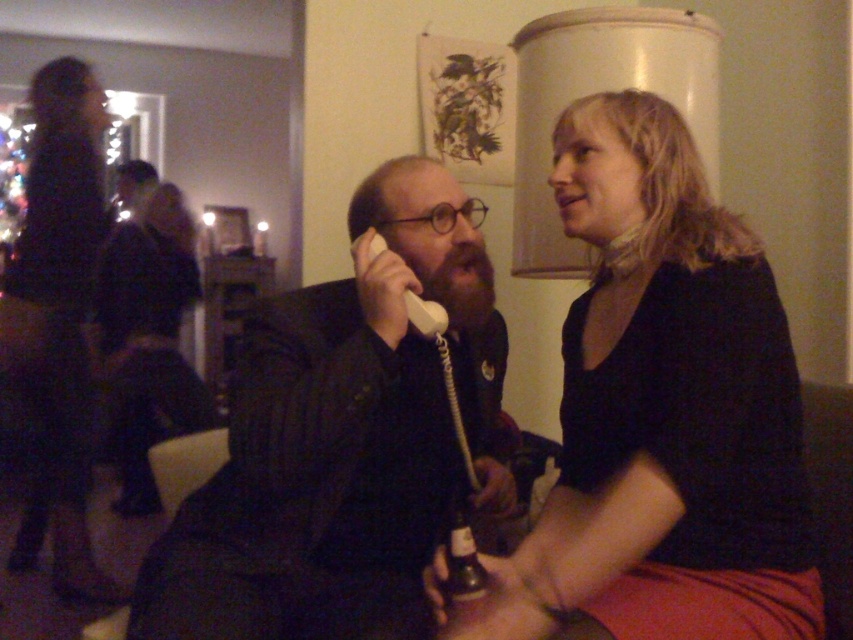
You are at a party and want to use the matte black phone at center to call someone. However, you need to reach it first. Since the dark fabric dress at left is in the way, can you still access the phone without moving the dress?

The matte black phone at center is located below dark fabric dress at left, so you can access the phone by reaching under the dark fabric dress at left without needing to move it.

You are a photographer trying to capture a clear photo of the matte black shirt at center and the matte black phone at center. Since both are dark, you need to adjust your camera focus. Which object should you focus on first to ensure it appears sharp in the photo?

The matte black shirt at center is positioned over the matte black phone at center, so focusing on the matte black shirt at center first will ensure it appears sharp while the phone may still be in focus but slightly less prominent due to its position underneath.

In the scene shown: You are a photographer trying to capture a candid shot of the matte black shirt at center and the dark fabric dress at left. Your camera has a maximum focus range of 2 meters. Will you be able to get both subjects in focus at the same time?

The matte black shirt at center and dark fabric dress at left are 2.17 meters apart. Since the distance between them exceeds the camera maximum focus range of 2 meters, you cannot get both subjects in focus at the same time.